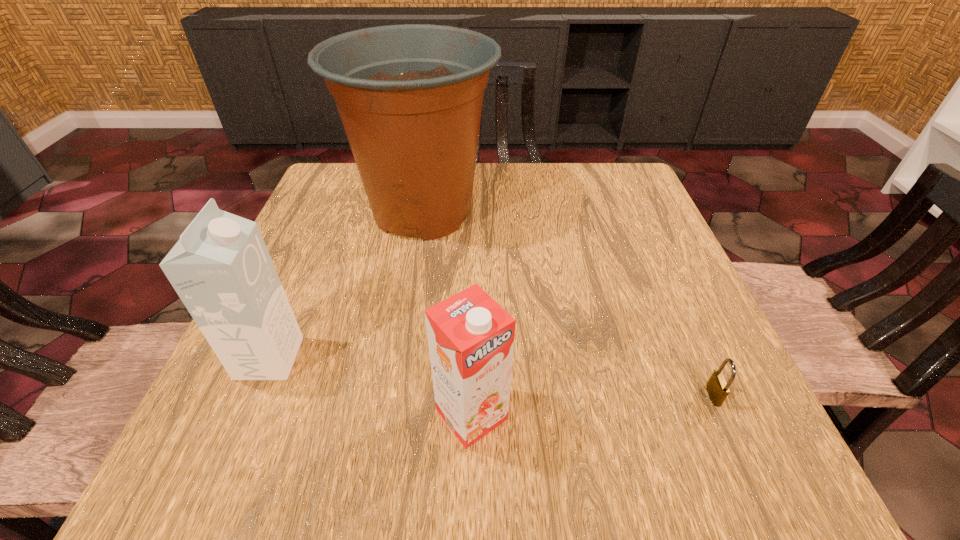
The width and height of the screenshot is (960, 540). I want to click on vacant area at the left edge, so click(331, 312).

This screenshot has width=960, height=540. I want to click on vacant space at the right edge of the desktop, so click(x=645, y=281).

The width and height of the screenshot is (960, 540). I want to click on vacant space at the far left corner of the desktop, so click(x=310, y=199).

Locate an element on the screen. Image resolution: width=960 pixels, height=540 pixels. vacant area at the near left corner is located at coordinates [x=176, y=473].

In the image, there is a desktop. Identify the location of free space at the far right corner. (602, 193).

Find the location of a particular element. Image resolution: width=960 pixels, height=540 pixels. blank area at the near right corner is located at coordinates (765, 481).

Find the location of a particular element. This screenshot has width=960, height=540. empty location between the shorter carton and the third nearest object is located at coordinates (371, 386).

The image size is (960, 540). I want to click on free area in between the rightmost object and the nearer carton, so click(592, 405).

This screenshot has height=540, width=960. What are the coordinates of `vacant area that lies between the flowerpot and the left carton` in the screenshot? It's located at (347, 285).

You are a GUI agent. You are given a task and a screenshot of the screen. Output one action in this format:
    pyautogui.click(x=<x>, y=<y>)
    Task: Click on the free area in between the shortest object and the nearer carton
    The width and height of the screenshot is (960, 540).
    Given the screenshot: What is the action you would take?
    pyautogui.click(x=592, y=405)